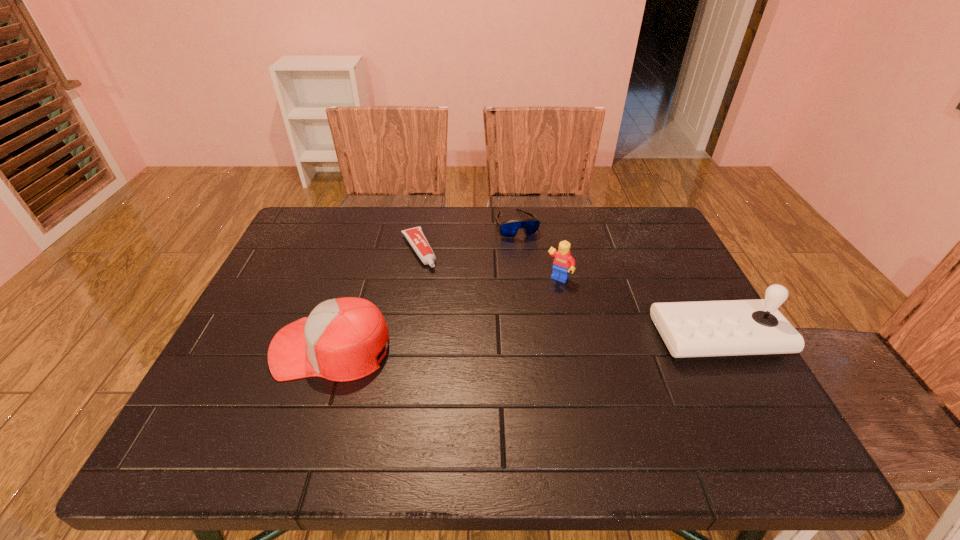
The image size is (960, 540). I want to click on vacant space on the desktop that is between the baseball cap and the joystick and is positioned on the face of the Lego, so click(513, 343).

This screenshot has height=540, width=960. I want to click on vacant spot on the desktop that is between the baseball cap and the joystick and is positioned on the front-facing side of the sunglasses, so click(567, 341).

This screenshot has width=960, height=540. In order to click on vacant space on the desktop that is between the baseball cap and the rightmost object and is positioned at the nozzle of the toothpaste in this screenshot , I will do (473, 344).